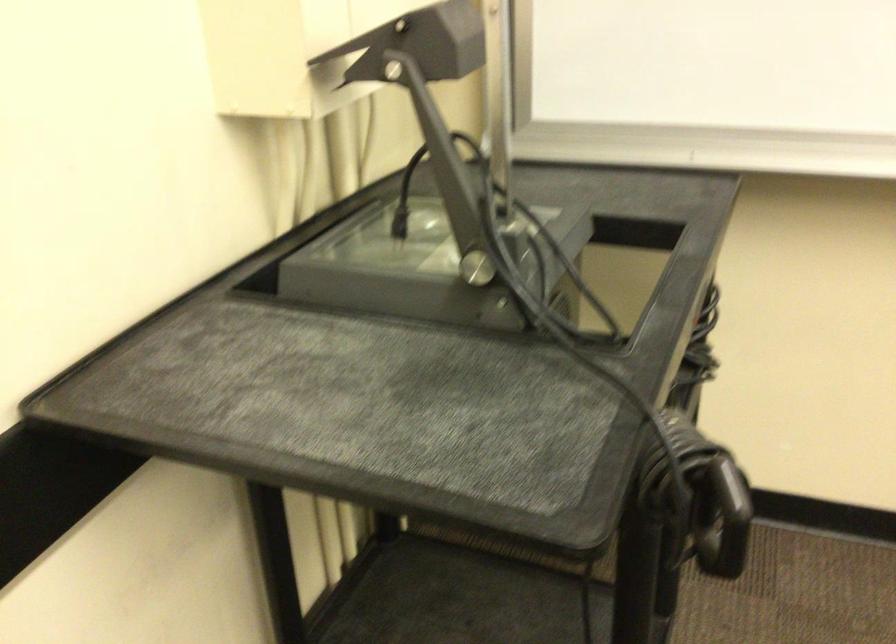
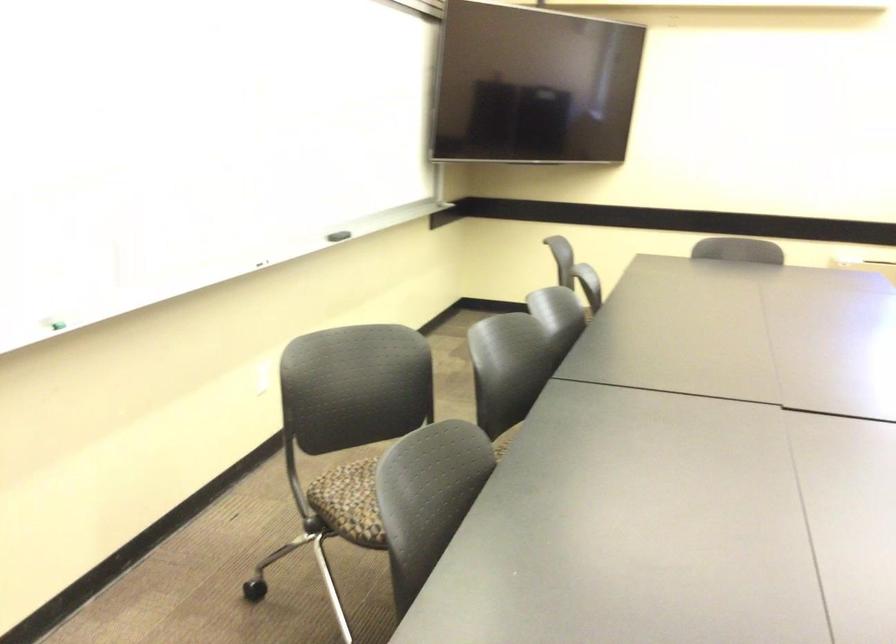
Question: The images are taken continuously from a first-person perspective. In which direction is your viewpoint rotating?

Choices:
 (A) Left
 (B) Right
 (C) Up
 (D) Down

Answer: (B)